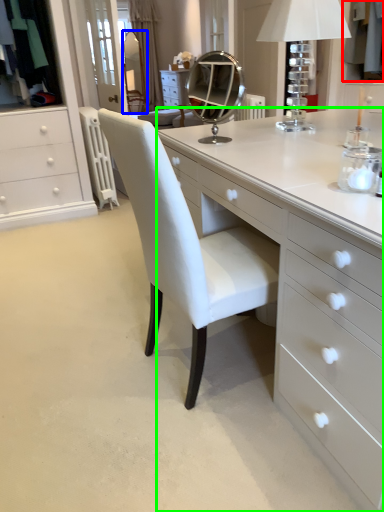
Question: Considering the real-world distances, which object is farthest from clothing (highlighted by a red box)? mirror (highlighted by a blue box) or table (highlighted by a green box)?

Choices:
 (A) mirror
 (B) table

Answer: (A)